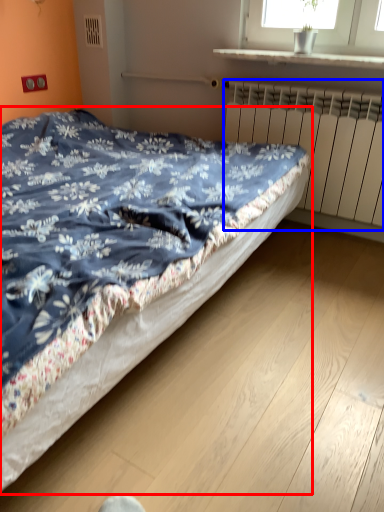
Question: Which object appears farthest to the camera in this image, bed (highlighted by a red box) or radiator (highlighted by a blue box)?

Choices:
 (A) bed
 (B) radiator

Answer: (B)